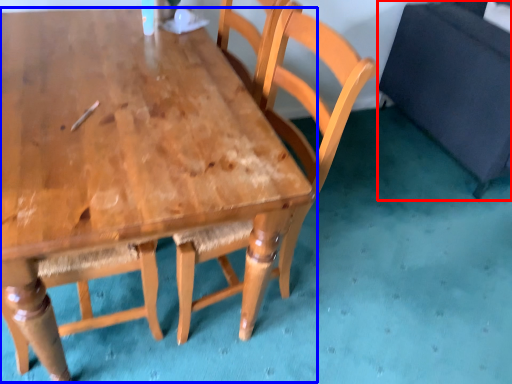
Question: Which point is further to the camera, swivel chair (highlighted by a red box) or table (highlighted by a blue box)?

Choices:
 (A) swivel chair
 (B) table

Answer: (A)